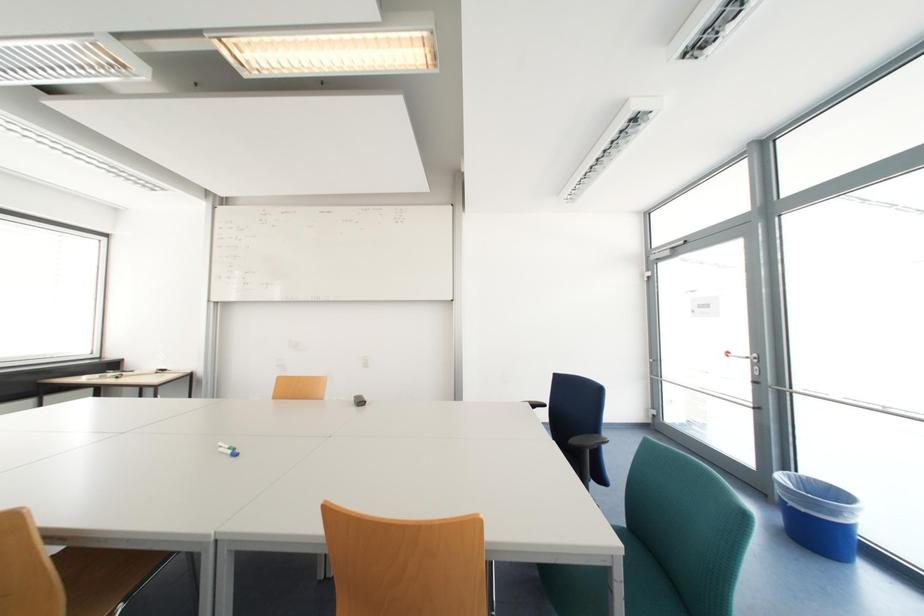
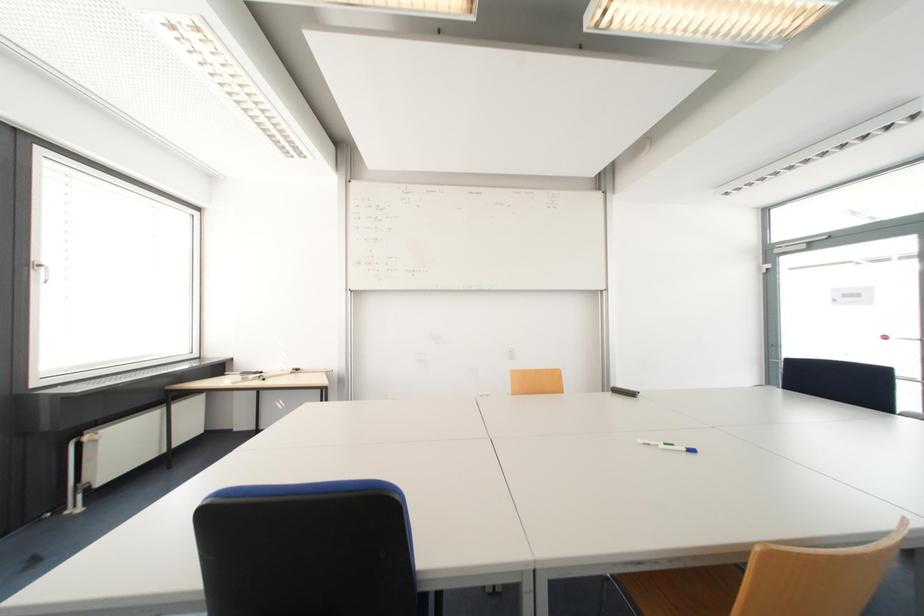
Question: Which direction would the cameraman need to move to produce the second image? Reply with the corresponding letter.

Choices:
 (A) Left
 (B) Right
 (C) Forward
 (D) Backward

Answer: (A)